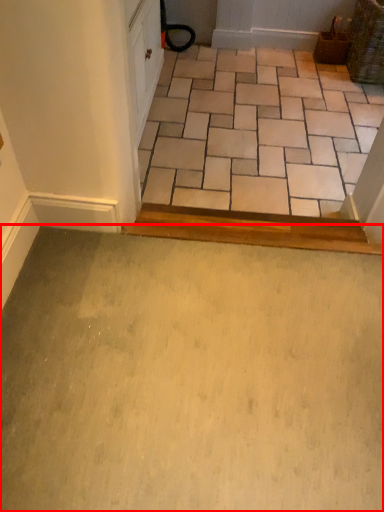
Question: In this image, where is path (annotated by the red box) located relative to ceramic tile?

Choices:
 (A) left
 (B) right

Answer: (A)